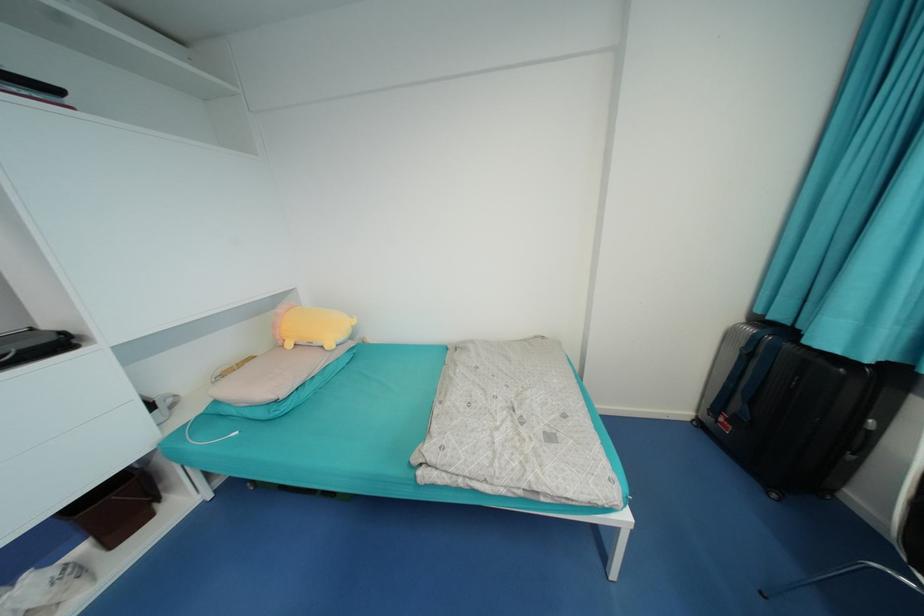
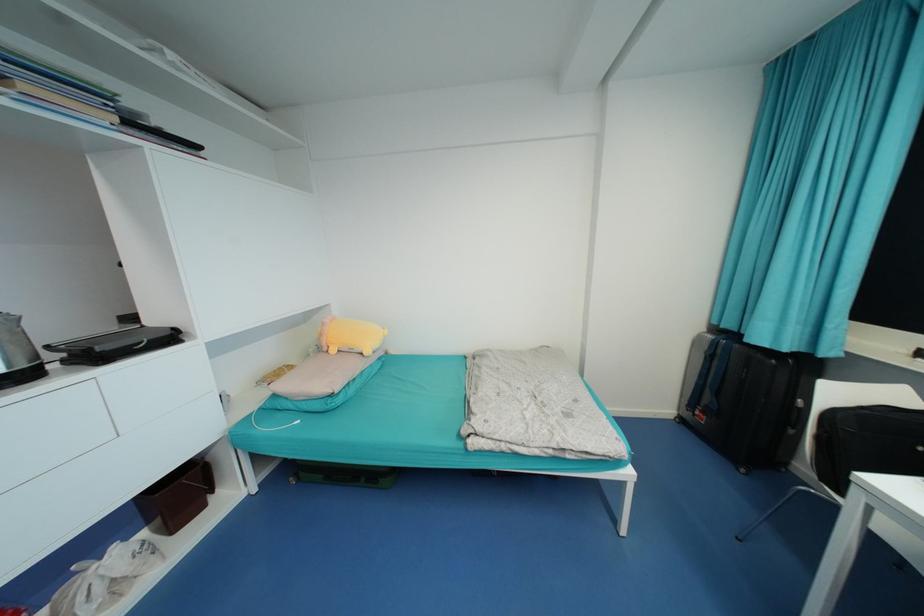
Question: Based on the continuous images, in which direction is the camera rotating? Reply with the corresponding letter.

Choices:
 (A) Left
 (B) Right
 (C) Up
 (D) Down

Answer: (C)